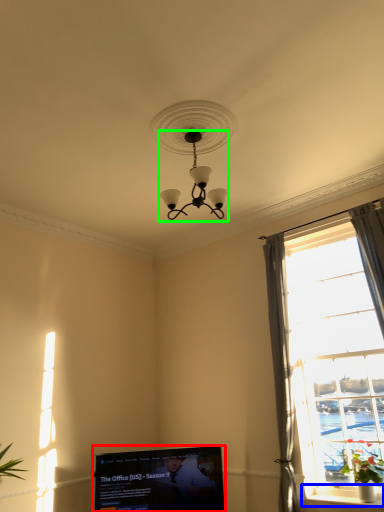
Question: Estimate the real-world distances between objects in this image. Which object is farther from television (highlighted by a red box), window sill (highlighted by a blue box) or lamp (highlighted by a green box)?

Choices:
 (A) window sill
 (B) lamp

Answer: (B)